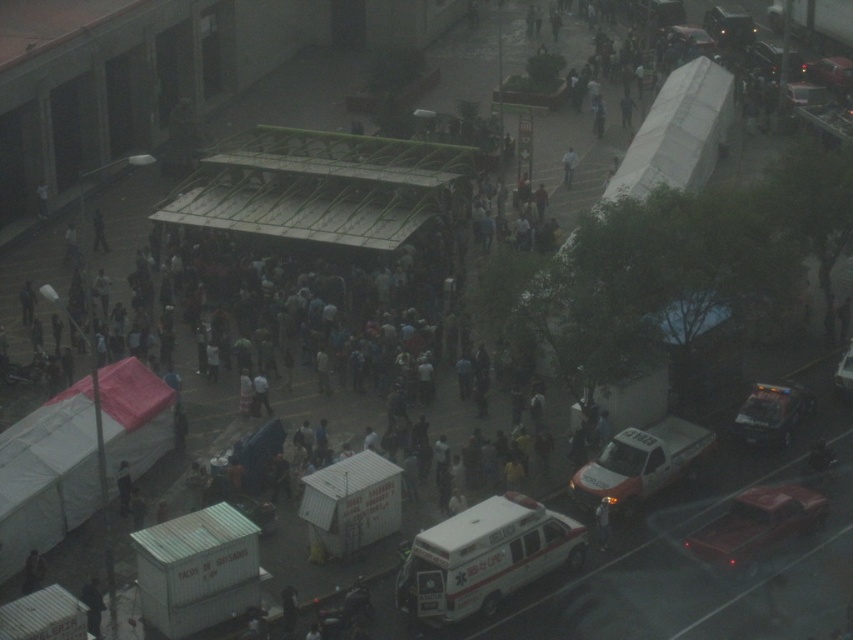
Which of these two, white fabric canopy at lower left or white matte ambulance at center-right, stands shorter?

white matte ambulance at center-right

Is white fabric canopy at lower left further to camera compared to white matte ambulance at center-right?

No.

Is point (70, 493) in front of point (608, 448)?

Yes, point (70, 493) is closer to viewer.

Find the location of a particular element. white fabric canopy at lower left is located at coordinates (47, 476).

Where is `white fabric canopy at lower left`? This screenshot has height=640, width=853. white fabric canopy at lower left is located at coordinates (47, 476).

Between point (82, 481) and point (598, 540), which one is positioned in front?

Positioned in front is point (598, 540).

Between point (62, 392) and point (607, 509), which one is positioned in front?

Point (607, 509) is more forward.

I want to click on white fabric canopy at lower left, so click(x=47, y=476).

Which of these two, white fabric canopy at lower left or white glossy ambulance at center, stands taller?

white fabric canopy at lower left

Can you confirm if white fabric canopy at lower left is bigger than white glossy ambulance at center?

Indeed, white fabric canopy at lower left has a larger size compared to white glossy ambulance at center.

The height and width of the screenshot is (640, 853). What are the coordinates of `white fabric canopy at lower left` in the screenshot? It's located at (47, 476).